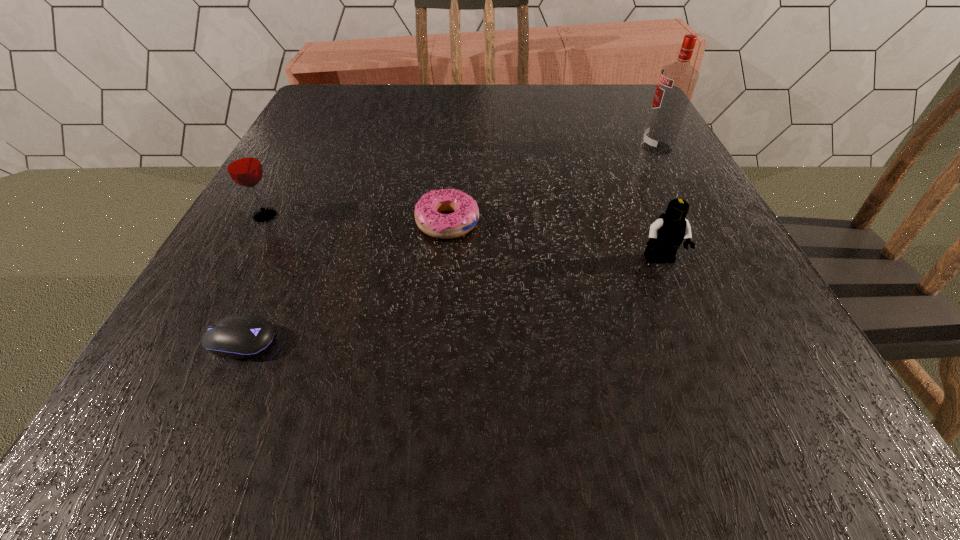
Where is `free spot that satisfies the following two spatial constraints: 1. on the back side of the doughnut; 2. on the left side of the computer mouse`? The width and height of the screenshot is (960, 540). free spot that satisfies the following two spatial constraints: 1. on the back side of the doughnut; 2. on the left side of the computer mouse is located at coordinates (295, 222).

You are a GUI agent. You are given a task and a screenshot of the screen. Output one action in this format:
    pyautogui.click(x=<x>, y=<y>)
    Task: Click on the free space in the image that satisfies the following two spatial constraints: 1. on the front label of the farthest object; 2. on the front-facing side of the fourth farthest object
    
    Given the screenshot: What is the action you would take?
    pyautogui.click(x=717, y=260)

The image size is (960, 540). I want to click on free location that satisfies the following two spatial constraints: 1. on the front label of the farthest object; 2. on the front-facing side of the fourth farthest object, so click(x=717, y=260).

Locate an element on the screen. The height and width of the screenshot is (540, 960). free space that satisfies the following two spatial constraints: 1. on the back side of the nearest object; 2. on the right side of the doughnut is located at coordinates (295, 222).